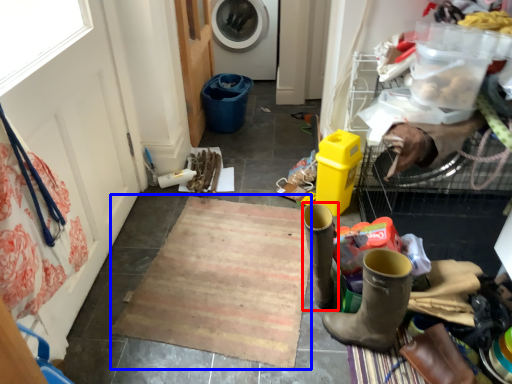
Question: Which object appears farthest to the camera in this image, footwear (highlighted by a red box) or doormat (highlighted by a blue box)?

Choices:
 (A) footwear
 (B) doormat

Answer: (B)